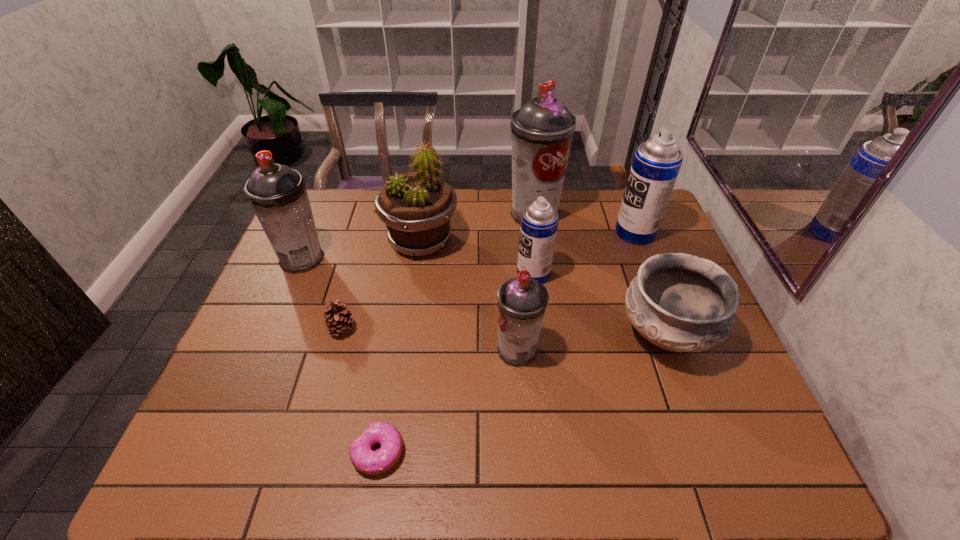
Where is `empty space that is in between the pinecone and the tallest aerosol can`? empty space that is in between the pinecone and the tallest aerosol can is located at coordinates (438, 272).

I want to click on empty location between the right blue aerosol can and the farthest gray aerosol can, so click(585, 223).

You are a GUI agent. You are given a task and a screenshot of the screen. Output one action in this format:
    pyautogui.click(x=<x>, y=<y>)
    Task: Click on the empty space between the nearer blue aerosol can and the second biggest gray aerosol can
    
    Given the screenshot: What is the action you would take?
    pyautogui.click(x=418, y=266)

The height and width of the screenshot is (540, 960). I want to click on free space between the third shortest object and the left blue aerosol can, so click(x=599, y=304).

At what (x,y) coordinates should I click in order to perform the action: click on vacant area that lies between the shortest object and the leftmost gray aerosol can. Please return your answer as a coordinate pair (x, y). The image size is (960, 540). Looking at the image, I should click on (340, 355).

Where is `empty space that is in between the tallest object and the pottery`? This screenshot has height=540, width=960. empty space that is in between the tallest object and the pottery is located at coordinates (599, 274).

The image size is (960, 540). Identify the location of free space between the pottery and the tallest object. (599, 274).

The width and height of the screenshot is (960, 540). I want to click on object that can be found as the second closest to the farthest gray aerosol can, so click(x=416, y=207).

Locate which object is the seventh closest to the left blue aerosol can. Please provide its 2D coordinates. Your answer should be formatted as a tuple, i.e. [(x, y)], where the tuple contains the x and y coordinates of a point satisfying the conditions above.

[(363, 458)]

Identify which aerosol can is the third nearest to the third shortest object. Please provide its 2D coordinates. Your answer should be formatted as a tuple, i.e. [(x, y)], where the tuple contains the x and y coordinates of a point satisfying the conditions above.

[(656, 163)]